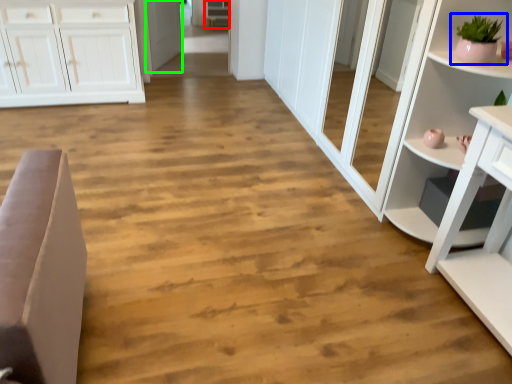
Question: Considering the real-world distances, which object is farthest from cabinetry (highlighted by a red box)? houseplant (highlighted by a blue box) or door (highlighted by a green box)?

Choices:
 (A) houseplant
 (B) door

Answer: (A)